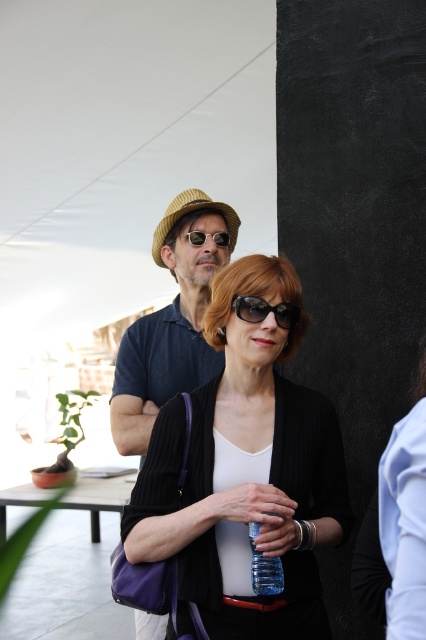
Can you confirm if black matte cardigan at center is positioned above blue plastic bottle at center?

Correct, black matte cardigan at center is located above blue plastic bottle at center.

Between point (163, 515) and point (281, 573), which one is positioned in front?

Positioned in front is point (281, 573).

Image resolution: width=426 pixels, height=640 pixels. In order to click on black matte cardigan at center in this screenshot , I will do `click(244, 474)`.

Is black matte cardigan at center further to the viewer compared to matte blue shirt at center?

That is False.

Does black matte cardigan at center have a smaller size compared to matte blue shirt at center?

Actually, black matte cardigan at center might be larger than matte blue shirt at center.

Is point (268, 444) in front of point (193, 266)?

Yes, it is in front of point (193, 266).

Find the location of a particular element. black matte cardigan at center is located at coordinates (244, 474).

Can you confirm if blue plastic bottle at center is positioned to the left of sunglasses at center?

Incorrect, blue plastic bottle at center is not on the left side of sunglasses at center.

Locate an element on the screen. This screenshot has height=640, width=426. blue plastic bottle at center is located at coordinates (264, 566).